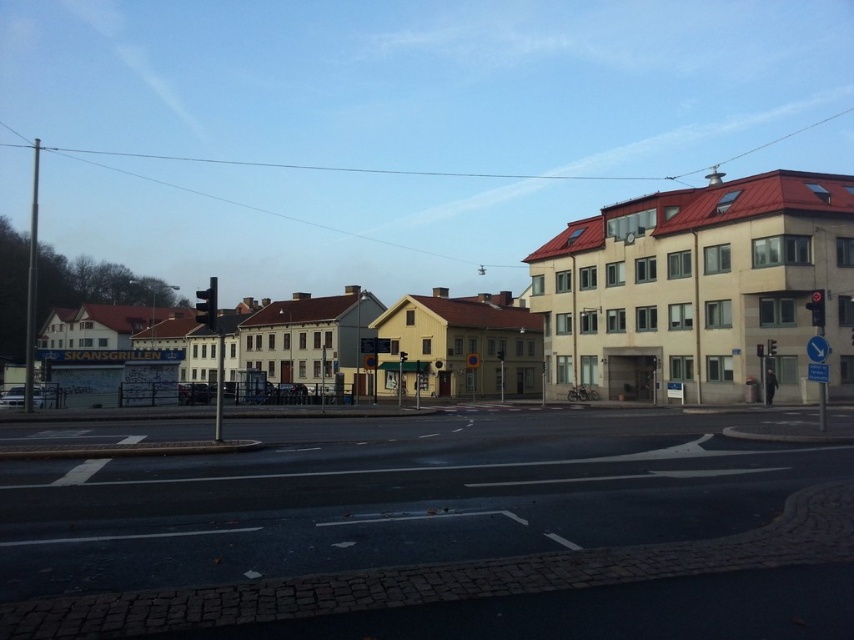
You are a pedestrian standing at the crosswalk and see the point marked at coordinates (x=208, y=305). Where exactly is this point located?

The point marked at coordinates (x=208, y=305) is located on the metallic traffic light at left.

You are a pedestrian standing at the edge of the road and want to cross. You see the metallic traffic light at left and the red glass traffic light at right. Which traffic light is closer to you?

The metallic traffic light at left is closer to you because it is further to the viewer than the red glass traffic light at right.

You are a pedestrian waiting at the crosswalk. You see the metallic traffic light at left and the red glass traffic light at upper center. Which one is taller?

Answer: The metallic traffic light at left is taller than the red glass traffic light at upper center.